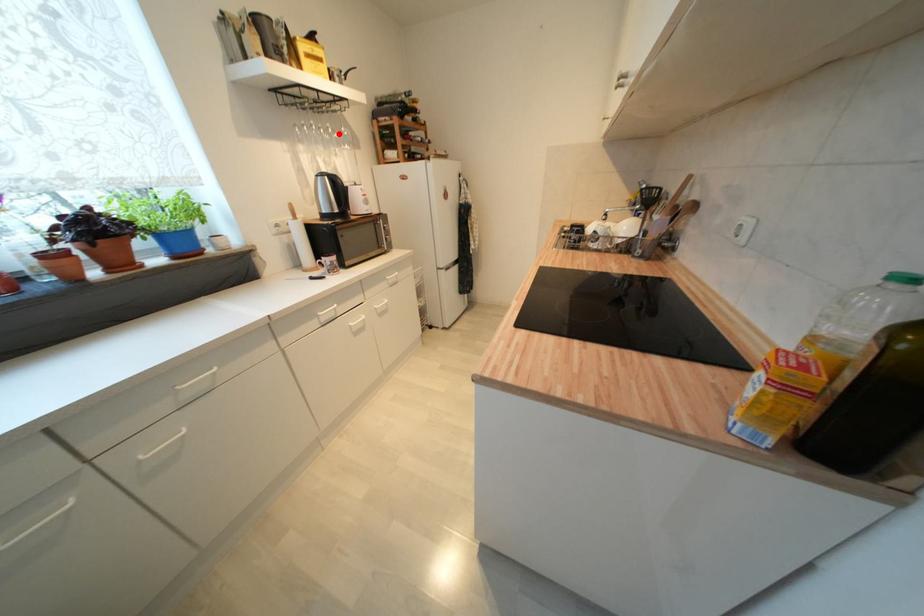
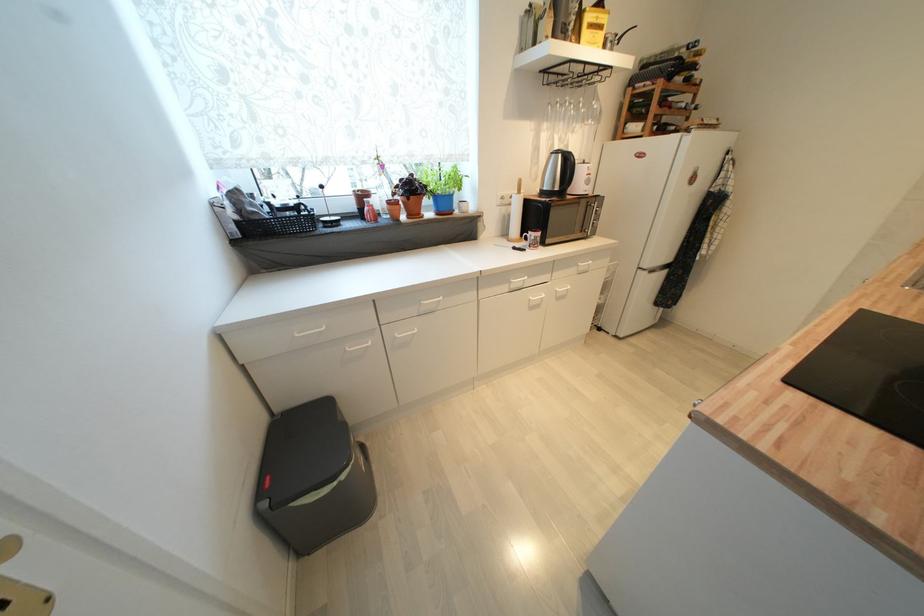
The point at the highlighted location is marked in the first image. Where is the corresponding point in the second image?

(589, 108)